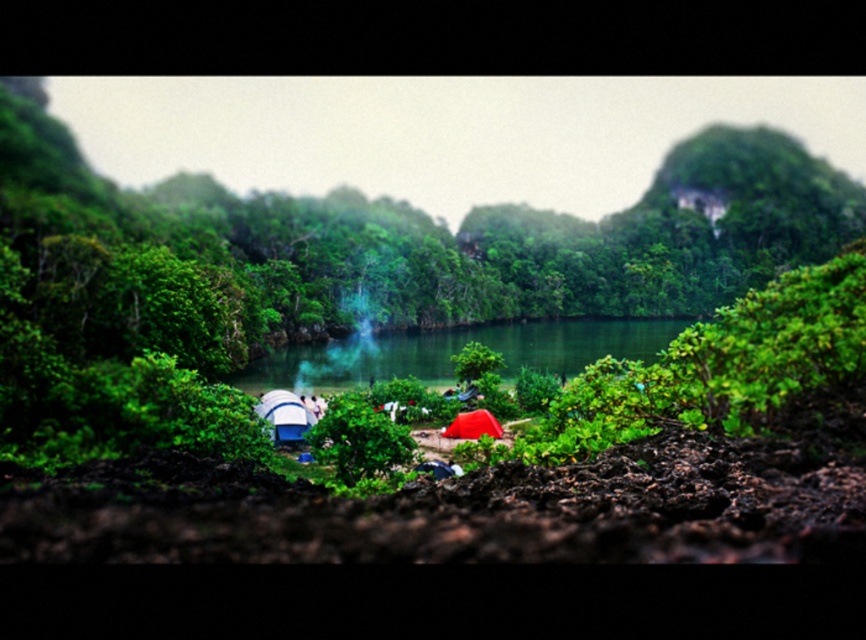
Is green leafy bush at center wider than green smooth water at center?

Correct, the width of green leafy bush at center exceeds that of green smooth water at center.

Does green leafy bush at center lie behind green smooth water at center?

No, green leafy bush at center is closer to the viewer.

Does point (26, 193) come closer to viewer compared to point (447, 369)?

Yes, it is in front of point (447, 369).

Locate an element on the screen. The height and width of the screenshot is (640, 866). green leafy bush at center is located at coordinates (341, 272).